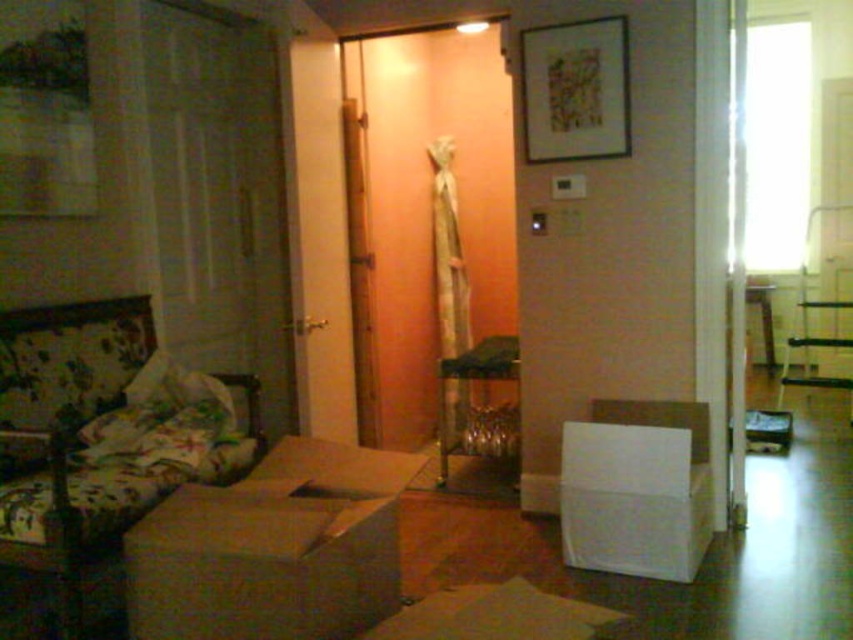
Does point (138, 401) come farther from viewer compared to point (457, 401)?

No, (138, 401) is closer to viewer.

Is floral fabric couch at left behind metallic glass table at center?

No, floral fabric couch at left is closer to the viewer.

Between point (21, 410) and point (486, 346), which one is positioned behind?

Point (486, 346)

Find the location of `floral fabric couch at left`. floral fabric couch at left is located at coordinates (102, 442).

Is brown cardboard box at lower left below metallic glass table at center?

Yes, brown cardboard box at lower left is below metallic glass table at center.

Identify the location of brown cardboard box at lower left. This screenshot has height=640, width=853. click(273, 548).

Can you confirm if brown cardboard box at lower left is thinner than matte wooden picture frame at upper center?

No.

Which of these two, brown cardboard box at lower left or matte wooden picture frame at upper center, stands shorter?

Standing shorter between the two is brown cardboard box at lower left.

The width and height of the screenshot is (853, 640). Describe the element at coordinates (273, 548) in the screenshot. I see `brown cardboard box at lower left` at that location.

Find the location of a particular element. The height and width of the screenshot is (640, 853). brown cardboard box at lower left is located at coordinates (273, 548).